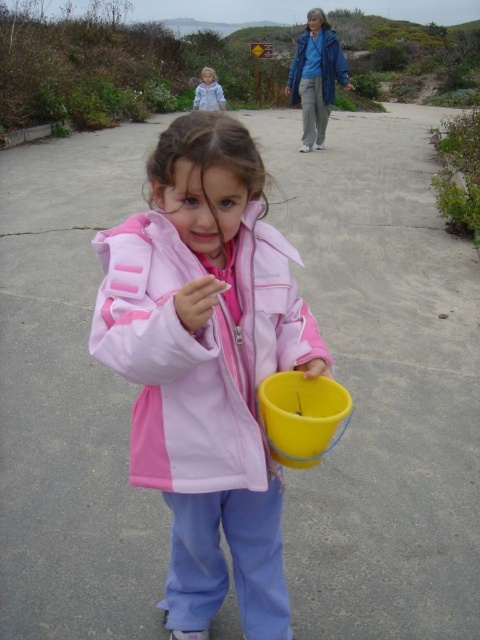
Question: Can you confirm if pink matte jacket at center is thinner than light blue denim jacket at upper center?

Choices:
 (A) no
 (B) yes

Answer: (B)

Question: Among these objects, which one is nearest to the camera?

Choices:
 (A) light blue denim jacket at upper center
 (B) pink matte jacket at center
 (C) blue smooth jacket at upper center

Answer: (B)

Question: Which point is farther from the camera taking this photo?

Choices:
 (A) (139, 451)
 (B) (201, 93)

Answer: (B)

Question: Which of the following is the farthest from the observer?

Choices:
 (A) (216, 84)
 (B) (291, 80)
 (C) (202, 429)

Answer: (A)

Question: Can you confirm if pink matte jacket at center is bigger than blue smooth jacket at upper center?

Choices:
 (A) yes
 (B) no

Answer: (B)

Question: Does pink matte jacket at center appear under light blue denim jacket at upper center?

Choices:
 (A) no
 (B) yes

Answer: (B)